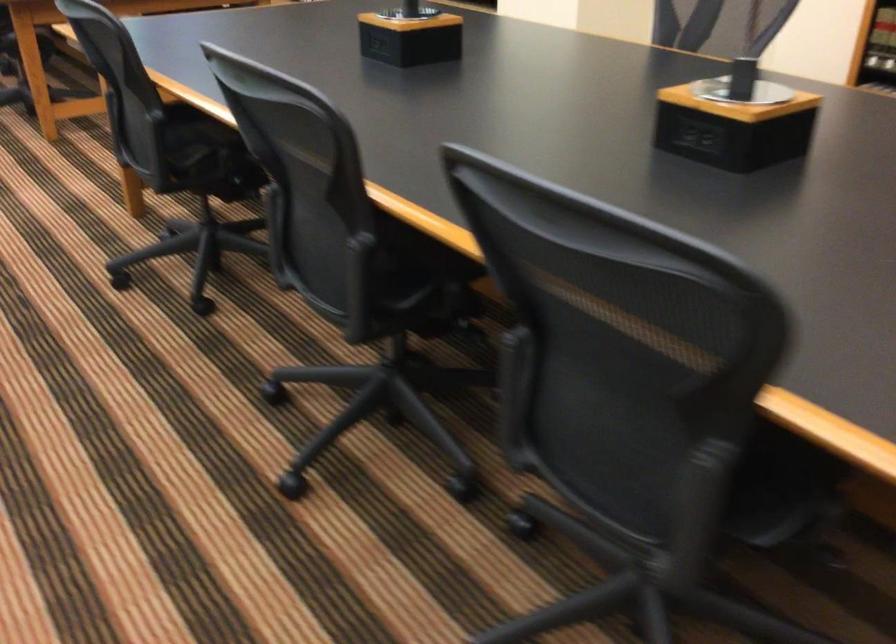
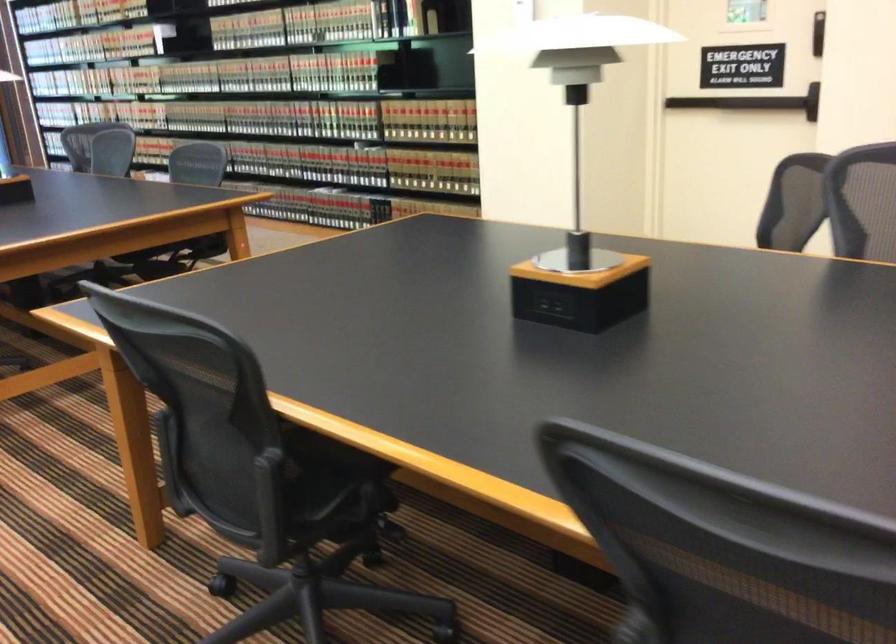
Where in the second image is the point corresponding to the point at 218,149 from the first image?

(336, 482)